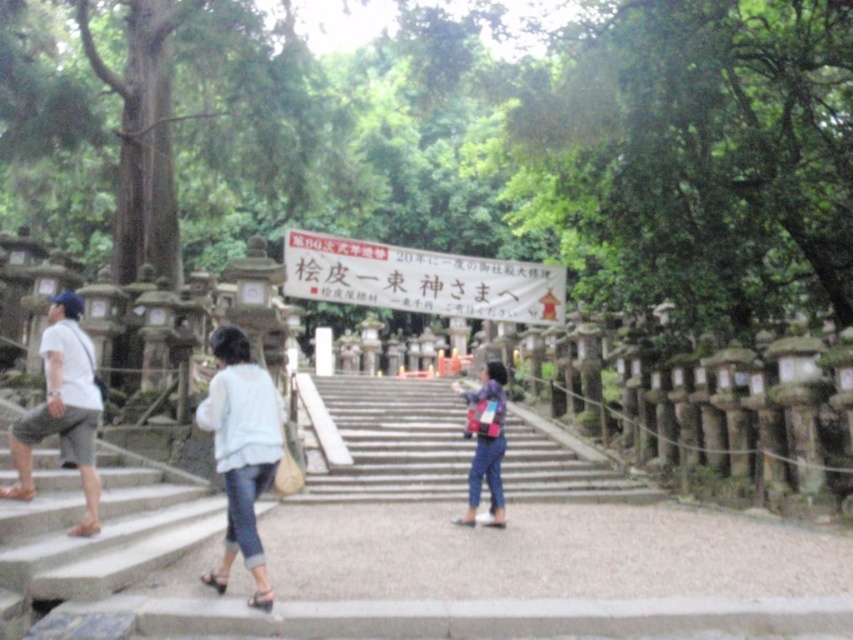
You are a visitor at the shrine and want to read the white paper sign at center. However, you are wearing light blue denim jeans at lower left that are restricting your movement. Can you move freely to approach the sign?

The white paper sign at center is bigger than the light blue denim jeans at lower left, but the size of the jeans does not affect your ability to move freely. You can approach the sign without any issues related to the size of your jeans.